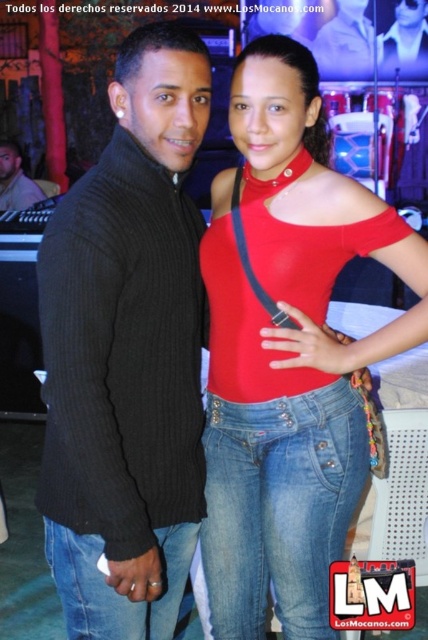
Is the position of black ribbed sweater at center more distant than that of matte red top at center?

No, it is not.

Who is taller, black ribbed sweater at center or matte red top at center?

With more height is matte red top at center.

This screenshot has width=428, height=640. What are the coordinates of `black ribbed sweater at center` in the screenshot? It's located at (127, 353).

Is point (294, 381) more distant than point (11, 182)?

No, (294, 381) is in front of (11, 182).

Can you confirm if matte red top at center is taller than matte black sweater at center?

Yes.

At what (x,y) coordinates should I click in order to perform the action: click on matte red top at center. Please return your answer as a coordinate pair (x, y). Looking at the image, I should click on (288, 352).

You are a GUI agent. You are given a task and a screenshot of the screen. Output one action in this format:
    pyautogui.click(x=<x>, y=<y>)
    Task: Click on the matte red top at center
    
    Given the screenshot: What is the action you would take?
    pyautogui.click(x=288, y=352)

How much distance is there between black ribbed sweater at center and matte black sweater at center?

black ribbed sweater at center is 11.96 feet from matte black sweater at center.

Can you confirm if black ribbed sweater at center is shorter than matte black sweater at center?

Incorrect, black ribbed sweater at center's height does not fall short of matte black sweater at center's.

Who is more forward, (127, 96) or (21, 193)?

Positioned in front is point (127, 96).

Where is `black ribbed sweater at center`? This screenshot has width=428, height=640. black ribbed sweater at center is located at coordinates (127, 353).